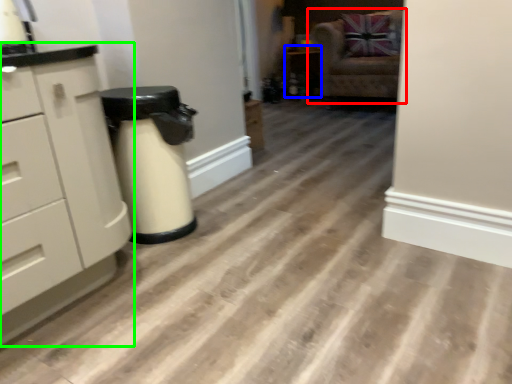
Question: Estimate the real-world distances between objects in this image. Which object is closer to chair (highlighted by a red box), cabinetry (highlighted by a blue box) or chest of drawers (highlighted by a green box)?

Choices:
 (A) cabinetry
 (B) chest of drawers

Answer: (A)